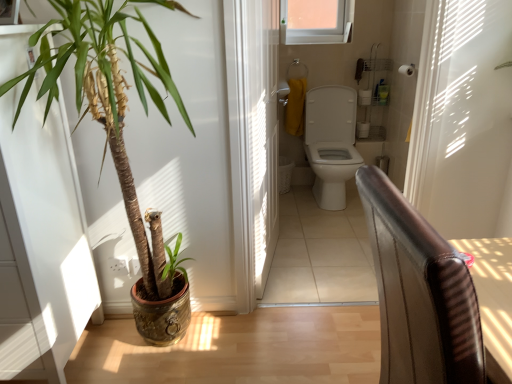
Where is `vacant space to the right of translucent plastic screen door at center`? The width and height of the screenshot is (512, 384). vacant space to the right of translucent plastic screen door at center is located at coordinates (302, 258).